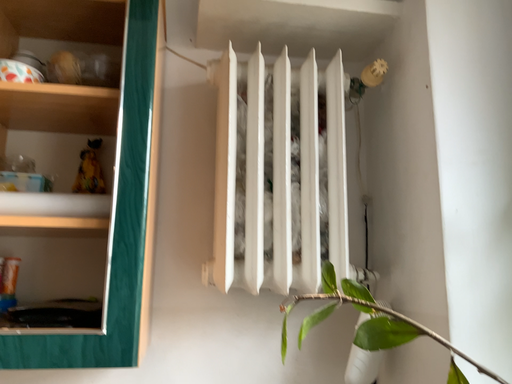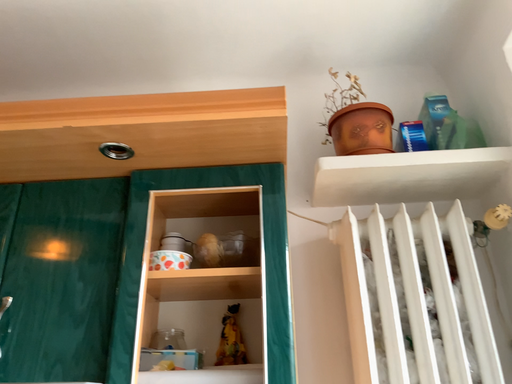
Question: Which way did the camera rotate in the video?

Choices:
 (A) rotated upward
 (B) rotated downward

Answer: (A)